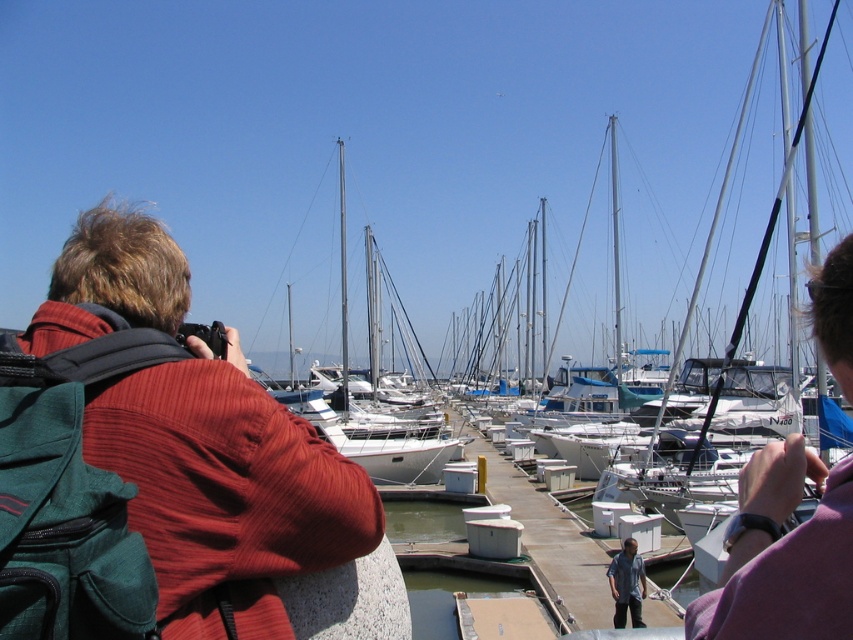
You are a photographer trying to capture the marina scene. You notice the red fabric jacket at left and the denim shirt at lower center in your frame. Which clothing item appears taller in the photo?

The red fabric jacket at left appears taller than the denim shirt at lower center in the photo.

You are a photographer planning to capture a group photo of the red fabric jacket at left and the denim shirt at lower center. If you want to ensure both subjects are in focus, which one should you position closer to the camera to account for their size difference?

Result: The red fabric jacket at left is wider than the denim shirt at lower center. To keep both in focus, position the red fabric jacket at left closer to the camera so its larger size is balanced with the denim shirt at lower center.

You are a photographer standing at the marina. You notice the red fabric jacket at left and the denim shirt at lower center in your viewfinder. Which clothing item appears larger in your photo?

The red fabric jacket at left appears larger in the photo because it is closer to the viewer than the denim shirt at lower center.